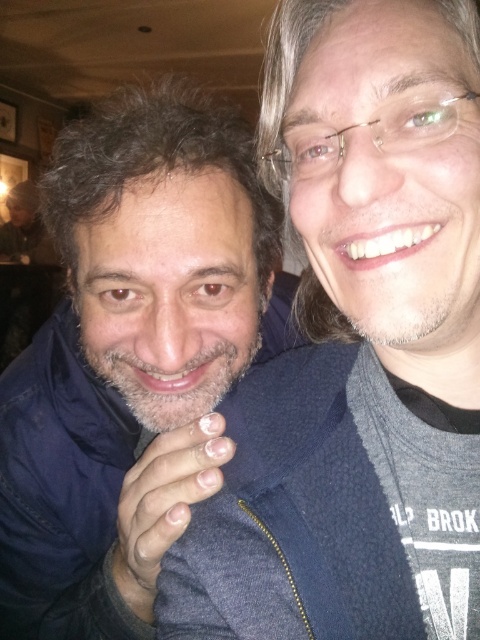
From the picture: You are a photographer trying to capture a group photo of two people wearing dark blue fleece jackets. You notice that the dark blue fleece jacket at center and the dark blue fleece jacket at left are positioned in a way that might block each other. Based on their sizes, which jacket should you adjust to ensure both are fully visible in the photo?

The dark blue fleece jacket at center occupies less space than the dark blue fleece jacket at left, so you should adjust the smaller jacket at center to avoid blocking the larger one at left.